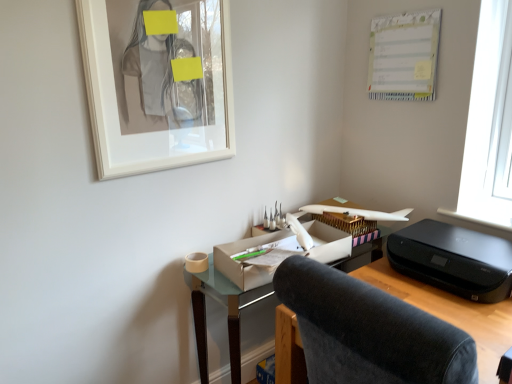
Question: Can you confirm if black plastic printer at right is bigger than white glossy picture frame at upper left?

Choices:
 (A) yes
 (B) no

Answer: (A)

Question: Considering the relative positions of black plastic printer at right and white glossy picture frame at upper left in the image provided, is black plastic printer at right to the right of white glossy picture frame at upper left from the viewer's perspective?

Choices:
 (A) no
 (B) yes

Answer: (B)

Question: Considering the relative sizes of black plastic printer at right and white glossy picture frame at upper left in the image provided, is black plastic printer at right smaller than white glossy picture frame at upper left?

Choices:
 (A) no
 (B) yes

Answer: (A)

Question: Is black plastic printer at right to the left of white glossy picture frame at upper left from the viewer's perspective?

Choices:
 (A) yes
 (B) no

Answer: (B)

Question: Is white glossy picture frame at upper left inside black plastic printer at right?

Choices:
 (A) no
 (B) yes

Answer: (A)

Question: From the image's perspective, relative to matte cardboard desk at center, is velvet dark gray chair at center above or below?

Choices:
 (A) below
 (B) above

Answer: (B)

Question: Is point (347, 314) closer or farther from the camera than point (270, 284)?

Choices:
 (A) closer
 (B) farther

Answer: (A)

Question: Based on their positions, is velvet dark gray chair at center located to the left or right of matte cardboard desk at center?

Choices:
 (A) left
 (B) right

Answer: (B)

Question: In terms of height, does velvet dark gray chair at center look taller or shorter compared to matte cardboard desk at center?

Choices:
 (A) short
 (B) tall

Answer: (A)

Question: From a real-world perspective, is white paperboard at upper right above or below matte cardboard box at center?

Choices:
 (A) above
 (B) below

Answer: (A)

Question: From the image's perspective, is white paperboard at upper right above or below matte cardboard box at center?

Choices:
 (A) below
 (B) above

Answer: (B)

Question: Based on their sizes in the image, would you say white paperboard at upper right is bigger or smaller than matte cardboard box at center?

Choices:
 (A) small
 (B) big

Answer: (A)

Question: Relative to matte cardboard box at center, is white paperboard at upper right in front or behind?

Choices:
 (A) behind
 (B) front

Answer: (A)

Question: Considering their positions, is white glossy picture frame at upper left located in front of or behind velvet dark gray chair at center?

Choices:
 (A) front
 (B) behind

Answer: (B)

Question: Looking at their shapes, would you say white glossy picture frame at upper left is wider or thinner than velvet dark gray chair at center?

Choices:
 (A) wide
 (B) thin

Answer: (B)